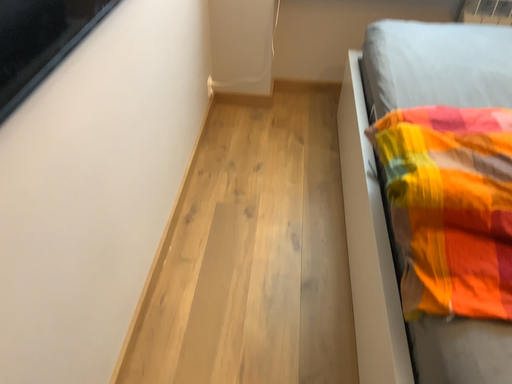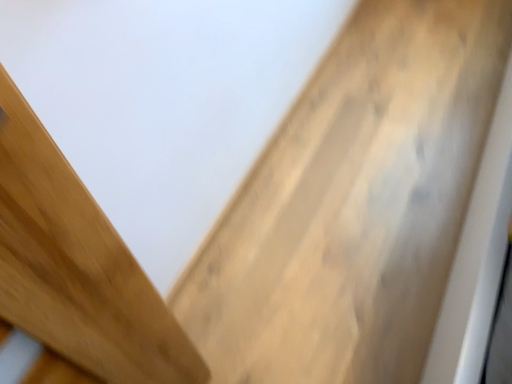
Question: Which way did the camera rotate in the video?

Choices:
 (A) rotated left
 (B) rotated right

Answer: (A)